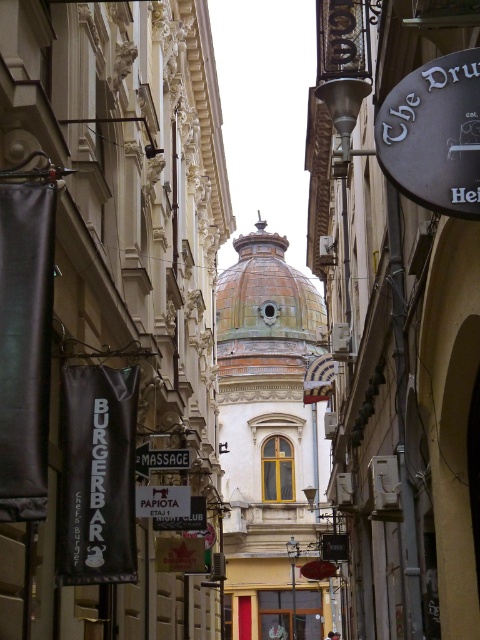
Is point (472, 141) positioned after point (251, 253)?

No, it is not.

Between black rubber sign at upper right and brown tiled dome at center, which one is positioned lower?

black rubber sign at upper right is lower down.

Describe the element at coordinates (434, 134) in the screenshot. I see `black rubber sign at upper right` at that location.

The image size is (480, 640). I want to click on black rubber sign at upper right, so click(434, 134).